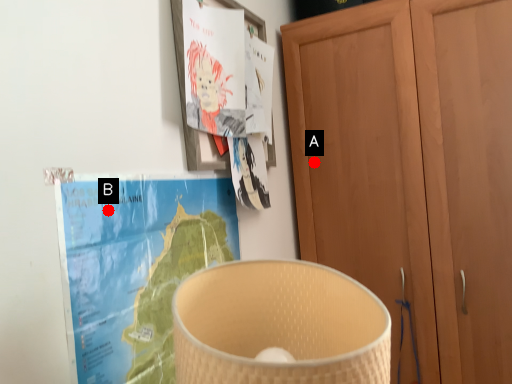
Question: Two points are circled on the image, labeled by A and B beside each circle. Which point appears closest to the camera in this image?

Choices:
 (A) A is closer
 (B) B is closer

Answer: (B)